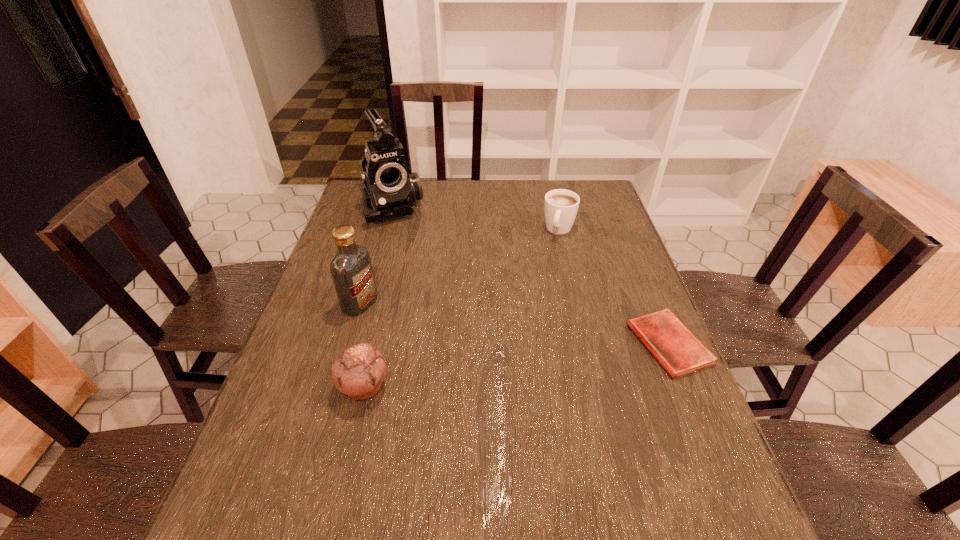
Image resolution: width=960 pixels, height=540 pixels. What are the coordinates of `vacant space located 0.360m with the handle on the side of the cappuccino` in the screenshot? It's located at (530, 320).

You are a GUI agent. You are given a task and a screenshot of the screen. Output one action in this format:
    pyautogui.click(x=<x>, y=<y>)
    Task: Click on the free space located 0.290m on the front-facing side of the vodka
    The image size is (960, 540).
    Given the screenshot: What is the action you would take?
    [467, 352]

Locate an element on the screen. vacant space situated on the front-facing side of the vodka is located at coordinates (391, 318).

Find the location of a particular element. This screenshot has height=540, width=960. vacant space located 0.340m on the front-facing side of the vodka is located at coordinates (485, 360).

Image resolution: width=960 pixels, height=540 pixels. Find the location of `vacant region located on the lens mount of the tallest object`. vacant region located on the lens mount of the tallest object is located at coordinates (420, 265).

Where is `free space located on the lens mount of the tallest object`? This screenshot has width=960, height=540. free space located on the lens mount of the tallest object is located at coordinates (407, 239).

The width and height of the screenshot is (960, 540). I want to click on vacant area situated on the lens mount of the tallest object, so click(x=432, y=285).

Locate an element on the screen. object located at the far edge is located at coordinates (390, 190).

At what (x,y) coordinates should I click in order to perform the action: click on muffin situated at the left edge. Please return your answer as a coordinate pair (x, y). Looking at the image, I should click on (359, 371).

You are a GUI agent. You are given a task and a screenshot of the screen. Output one action in this format:
    pyautogui.click(x=<x>, y=<y>)
    Task: Click on the vodka that is at the left edge
    
    Given the screenshot: What is the action you would take?
    pyautogui.click(x=351, y=269)